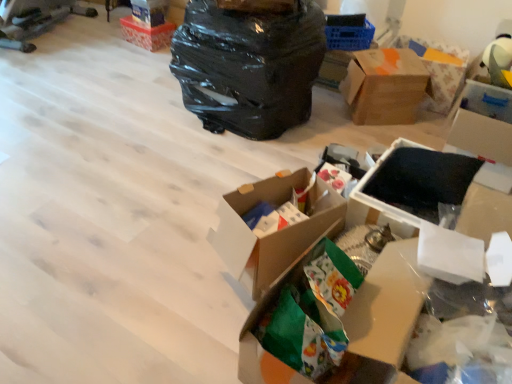
Question: Which direction should I rotate to look at black foam at center, the 2th storage box viewed from the right?

Choices:
 (A) right
 (B) left

Answer: (A)

Question: From the image's perspective, is cardboard box at center, which appears as the 2th box when viewed from the left, beneath orange-patterned cardboard box at upper right?

Choices:
 (A) yes
 (B) no

Answer: (A)

Question: Is cardboard box at center, which appears as the 2th box when viewed from the left, to the left of orange-patterned cardboard box at upper right from the viewer's perspective?

Choices:
 (A) no
 (B) yes

Answer: (B)

Question: Can you confirm if cardboard box at center, the 2th box from the front, is smaller than orange-patterned cardboard box at upper right?

Choices:
 (A) yes
 (B) no

Answer: (A)

Question: From the image's perspective, would you say cardboard box at center, the fourth box when ordered from back to front, is positioned over orange-patterned cardboard box at upper right?

Choices:
 (A) yes
 (B) no

Answer: (B)

Question: Can you confirm if cardboard box at center, the fourth box viewed from the top, is wider than orange-patterned cardboard box at upper right?

Choices:
 (A) no
 (B) yes

Answer: (A)

Question: Can you confirm if cardboard box at center, positioned as the fourth box in right-to-left order, is positioned to the right of orange-patterned cardboard box at upper right?

Choices:
 (A) yes
 (B) no

Answer: (B)

Question: Considering the relative sizes of black matte storage box at upper right, the second storage box viewed from the back, and green paper bag at center, the 5th box in the top-to-bottom sequence, in the image provided, is black matte storage box at upper right, the second storage box viewed from the back, taller than green paper bag at center, the 5th box in the top-to-bottom sequence,?

Choices:
 (A) no
 (B) yes

Answer: (B)

Question: From the image's perspective, is black matte storage box at upper right, acting as the second storage box starting from the top, on top of green paper bag at center, the 1th box in the front-to-back sequence?

Choices:
 (A) no
 (B) yes

Answer: (B)

Question: Is black matte storage box at upper right, marked as the 4th storage box in a left-to-right arrangement, thinner than green paper bag at center, which ranks as the 1th box in bottom-to-top order?

Choices:
 (A) yes
 (B) no

Answer: (B)

Question: Would you say black matte storage box at upper right, the second storage box viewed from the back, is outside green paper bag at center, which is the 3th box from right to left?

Choices:
 (A) yes
 (B) no

Answer: (A)

Question: From a real-world perspective, does black matte storage box at upper right, marked as the 4th storage box in a left-to-right arrangement, stand above green paper bag at center, the 5th box in the top-to-bottom sequence?

Choices:
 (A) no
 (B) yes

Answer: (A)

Question: Could you tell me if black matte storage box at upper right, which appears as the third storage box when ordered from the bottom, is facing green paper bag at center, which is counted as the 3th box, starting from the left?

Choices:
 (A) yes
 (B) no

Answer: (A)

Question: From the image's perspective, is brown cardboard box at upper right, positioned as the fourth box in front-to-back order, located beneath orange-patterned cardboard box at upper right?

Choices:
 (A) yes
 (B) no

Answer: (A)